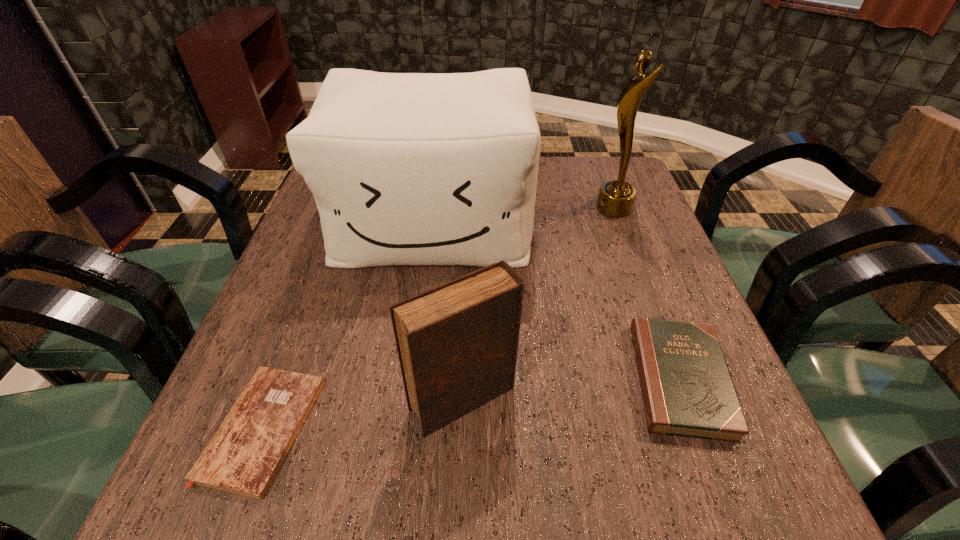
Where is `vacant space situated 0.070m on the front-facing side of the award`? The image size is (960, 540). vacant space situated 0.070m on the front-facing side of the award is located at coordinates (569, 208).

I want to click on vacant space located on the side of the cushion with the smiley face, so click(x=418, y=340).

Locate an element on the screen. This screenshot has width=960, height=540. vacant space located 0.280m on the back of the second Bible from right to left is located at coordinates (468, 260).

You are a GUI agent. You are given a task and a screenshot of the screen. Output one action in this format:
    pyautogui.click(x=<x>, y=<y>)
    Task: Click on the free spot located on the left of the second shortest object
    The width and height of the screenshot is (960, 540).
    Given the screenshot: What is the action you would take?
    pyautogui.click(x=499, y=379)

Locate an element on the screen. Image resolution: width=960 pixels, height=540 pixels. vacant point located 0.080m on the right of the leftmost Bible is located at coordinates point(362,428).

At what (x,y) coordinates should I click in order to perform the action: click on award that is at the far edge. Please return your answer as a coordinate pair (x, y). Looking at the image, I should click on (616, 198).

The image size is (960, 540). What are the coordinates of `cushion positioned at the far edge` in the screenshot? It's located at (406, 168).

Locate an element on the screen. object present at the near edge is located at coordinates coord(244,455).

The width and height of the screenshot is (960, 540). I want to click on cushion that is at the left edge, so click(406, 168).

Find the location of a particular element. This screenshot has width=960, height=540. Bible situated at the left edge is located at coordinates click(x=244, y=455).